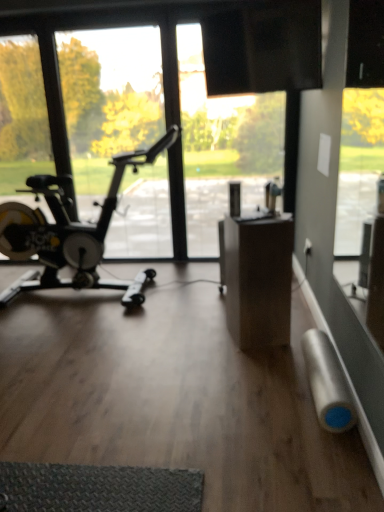
Where is `blank space to the left of silver matte duct tape at lower right`? blank space to the left of silver matte duct tape at lower right is located at coordinates (255, 396).